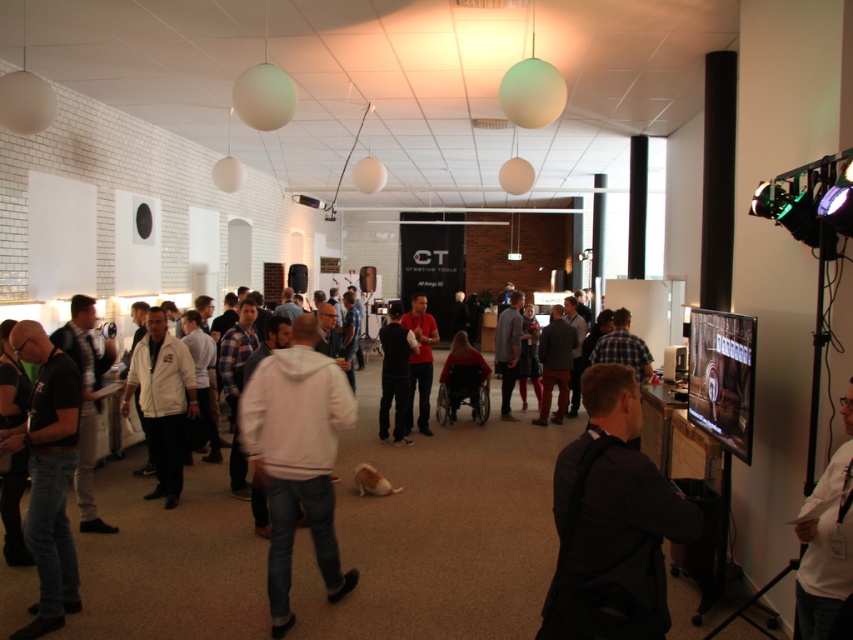
You are standing in the event space and see the point marked at coordinates (48, 474). What object is located at that point?

The point at coordinates (48, 474) marks the location of the black matte t shirt at center.

You are a photographer at the event and need to take a photo of both the white matte jacket at center and the red matte shirt at center. Which one should you focus on first if you want to capture them both in the same frame without adjusting your camera angle?

The white matte jacket at center is not as tall as the red matte shirt at center, so you should focus on the red matte shirt at center first to ensure it fits within the frame.